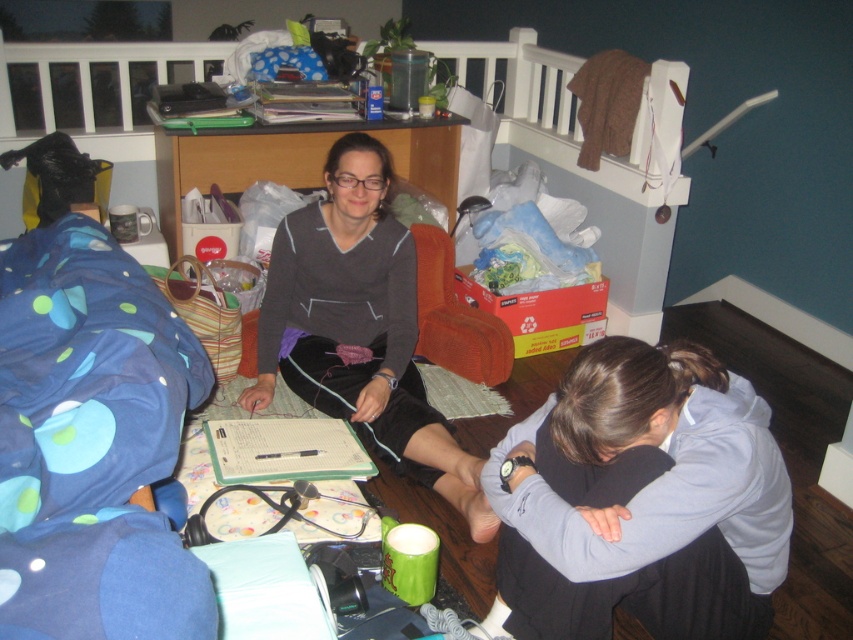
Question: Which point is closer to the camera?

Choices:
 (A) gray fleece hoodie at lower right
 (B) matte gray sweater at center

Answer: (A)

Question: Can you confirm if gray fleece hoodie at lower right is positioned to the right of matte gray sweater at center?

Choices:
 (A) no
 (B) yes

Answer: (B)

Question: Does gray fleece hoodie at lower right have a lesser width compared to matte gray sweater at center?

Choices:
 (A) no
 (B) yes

Answer: (B)

Question: Which object is farther from the camera taking this photo?

Choices:
 (A) gray fleece hoodie at lower right
 (B) matte gray sweater at center

Answer: (B)

Question: Where is gray fleece hoodie at lower right located in relation to matte gray sweater at center in the image?

Choices:
 (A) left
 (B) right

Answer: (B)

Question: Which of the following is the closest to the observer?

Choices:
 (A) (329, 397)
 (B) (503, 593)

Answer: (B)